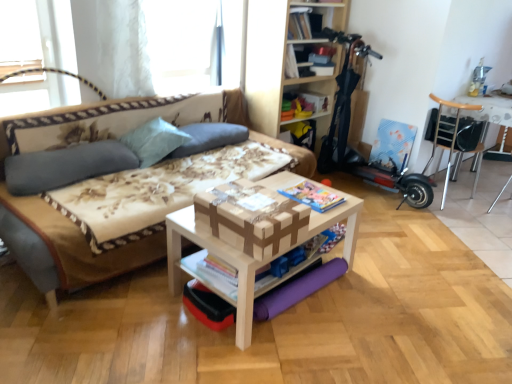
At what (x,y) coordinates should I click in order to perform the action: click on vacant point above matte cardboard storage box at upper center (from a real-world perspective). Please return your answer as a coordinate pair (x, y). The image size is (512, 384). Looking at the image, I should click on (307, 88).